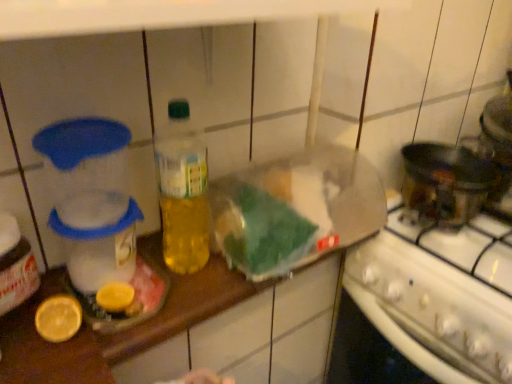
What do you see at coordinates (182, 191) in the screenshot?
I see `translucent plastic bottle at center` at bounding box center [182, 191].

In order to click on white glossy stove at lower right in this screenshot , I will do `click(431, 309)`.

Measure the distance between white glossy stove at lower right and camera.

They are 26.99 inches apart.

Identify the location of yellow matte lemon at lower left. (58, 318).

This screenshot has width=512, height=384. What are the coordinates of `translucent plastic container at left` in the screenshot? It's located at (91, 198).

Between translucent plastic container at left and yellow matte lemon at lower left, which one has less height?

Standing shorter between the two is yellow matte lemon at lower left.

Does translucent plastic container at left touch yellow matte lemon at lower left?

translucent plastic container at left and yellow matte lemon at lower left are clearly separated.

From the image's perspective, relative to yellow matte lemon at lower left, is translucent plastic container at left above or below?

Based on their image positions, translucent plastic container at left is located above yellow matte lemon at lower left.

Considering the positions of objects translucent plastic container at left and yellow matte lemon at lower left in the image provided, who is behind, translucent plastic container at left or yellow matte lemon at lower left?

Positioned behind is yellow matte lemon at lower left.

Could you tell me if yellow matte lemon at lower left is facing translucent plastic container at left?

No, yellow matte lemon at lower left is not oriented towards translucent plastic container at left.

From the image's perspective, would you say yellow matte lemon at lower left is positioned over translucent plastic container at left?

No, from the image's perspective, yellow matte lemon at lower left is not above translucent plastic container at left.

Is yellow matte lemon at lower left at the left side of translucent plastic container at left?

Correct, you'll find yellow matte lemon at lower left to the left of translucent plastic container at left.

What's the angular difference between translucent plastic bottle at center and yellow matte lemon at lower left's facing directions?

10 degrees.

Visually, is translucent plastic bottle at center positioned to the left or to the right of yellow matte lemon at lower left?

Clearly, translucent plastic bottle at center is on the right of yellow matte lemon at lower left in the image.

Is translucent plastic bottle at center in front of or behind yellow matte lemon at lower left in the image?

In the image, translucent plastic bottle at center appears behind yellow matte lemon at lower left.

From the image's perspective, is translucent plastic bottle at center above or below yellow matte lemon at lower left?

From the image's perspective, translucent plastic bottle at center appears above yellow matte lemon at lower left.

Which object is positioned more to the left, yellow matte lemon at lower left or white glossy stove at lower right?

Positioned to the left is yellow matte lemon at lower left.

From the image's perspective, which object appears higher, yellow matte lemon at lower left or white glossy stove at lower right?

yellow matte lemon at lower left is shown above in the image.

Considering the points (55, 334) and (457, 306), which point is in front, point (55, 334) or point (457, 306)?

The point (55, 334) is more forward.

Who is bigger, yellow matte lemon at lower left or white glossy stove at lower right?

white glossy stove at lower right is bigger.

Is white glossy stove at lower right a part of translucent plastic container at left?

No, translucent plastic container at left does not contain white glossy stove at lower right.

At what (x,y) coordinates should I click in order to perform the action: click on stove below the translucent plastic container at left (from the image's perspective). Please return your answer as a coordinate pair (x, y). Looking at the image, I should click on (431, 309).

Is there a large distance between translucent plastic container at left and white glossy stove at lower right?

Actually, translucent plastic container at left and white glossy stove at lower right are a little close together.

Is translucent plastic container at left wider or thinner than white glossy stove at lower right?

translucent plastic container at left is thinner than white glossy stove at lower right.

From a real-world perspective, between white glossy stove at lower right and translucent plastic container at left, who is vertically lower?

white glossy stove at lower right is physically lower.

Is white glossy stove at lower right not near translucent plastic container at left?

No, white glossy stove at lower right is in close proximity to translucent plastic container at left.

Consider the image. Is translucent plastic container at left at the back of white glossy stove at lower right?

No, white glossy stove at lower right is not facing the opposite direction of translucent plastic container at left.

How many degrees apart are the facing directions of translucent plastic container at left and translucent plastic bottle at center?

The facing directions of translucent plastic container at left and translucent plastic bottle at center are 10 degrees apart.

Is translucent plastic container at left wider or thinner than translucent plastic bottle at center?

translucent plastic container at left is wider than translucent plastic bottle at center.

Is translucent plastic container at left oriented towards translucent plastic bottle at center?

No, translucent plastic container at left is not aimed at translucent plastic bottle at center.

Does point (55, 219) lie behind point (165, 245)?

No, (55, 219) is closer to viewer.

At what (x,y) coordinates should I click in order to perform the action: click on appliance on the right of yellow matte lemon at lower left. Please return your answer as a coordinate pair (x, y). The height and width of the screenshot is (384, 512). Looking at the image, I should click on (91, 198).

Locate an element on the screen. lemon that appears behind the translucent plastic container at left is located at coordinates (x=58, y=318).

From the image, which object appears to be farther from translucent plastic bottle at center, translucent plastic container at left or white glossy stove at lower right?

The object further to translucent plastic bottle at center is white glossy stove at lower right.

Based on their spatial positions, is white glossy stove at lower right or translucent plastic container at left further from translucent plastic bottle at center?

white glossy stove at lower right is further to translucent plastic bottle at center.

In the scene shown: Looking at the image, which one is located closer to yellow matte lemon at lower left, white glossy stove at lower right or translucent plastic container at left?

translucent plastic container at left.

Considering their positions, is translucent plastic bottle at center positioned further to yellow matte lemon at lower left than white glossy stove at lower right?

white glossy stove at lower right is positioned further to the anchor yellow matte lemon at lower left.

When comparing their distances from translucent plastic container at left, does translucent plastic bottle at center or white glossy stove at lower right seem closer?

translucent plastic bottle at center.

Which object lies nearer to the anchor point yellow matte lemon at lower left, translucent plastic container at left or translucent plastic bottle at center?

Based on the image, translucent plastic container at left appears to be nearer to yellow matte lemon at lower left.

Considering their positions, is yellow matte lemon at lower left positioned further to translucent plastic bottle at center than white glossy stove at lower right?

white glossy stove at lower right.

From the image, which object appears to be nearer to yellow matte lemon at lower left, translucent plastic bottle at center or translucent plastic container at left?

translucent plastic container at left lies closer to yellow matte lemon at lower left than the other object.

In order to click on bottle between translucent plastic container at left and white glossy stove at lower right in the horizontal direction in this screenshot , I will do `click(182, 191)`.

At what (x,y) coordinates should I click in order to perform the action: click on appliance situated between yellow matte lemon at lower left and white glossy stove at lower right from left to right. Please return your answer as a coordinate pair (x, y). The width and height of the screenshot is (512, 384). Looking at the image, I should click on (91, 198).

Locate an element on the screen. Image resolution: width=512 pixels, height=384 pixels. bottle between translucent plastic container at left and yellow matte lemon at lower left from top to bottom is located at coordinates (182, 191).

The width and height of the screenshot is (512, 384). I want to click on bottle between yellow matte lemon at lower left and white glossy stove at lower right in the horizontal direction, so click(x=182, y=191).